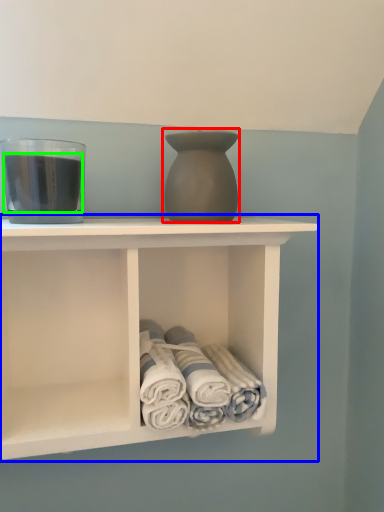
Question: Which object is positioned farthest from vase (highlighted by a red box)? Select from shelf (highlighted by a blue box) and beverage (highlighted by a green box).

Choices:
 (A) shelf
 (B) beverage

Answer: (A)